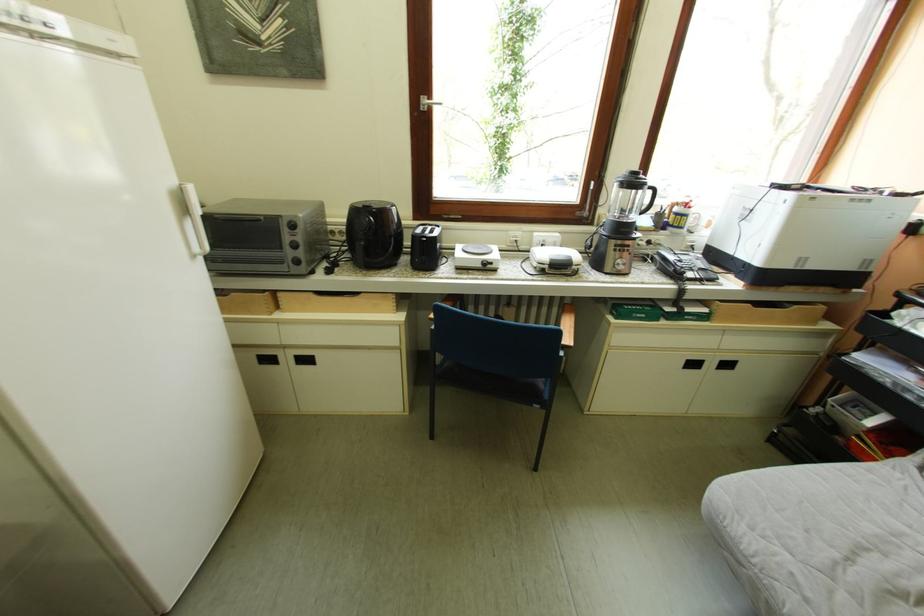
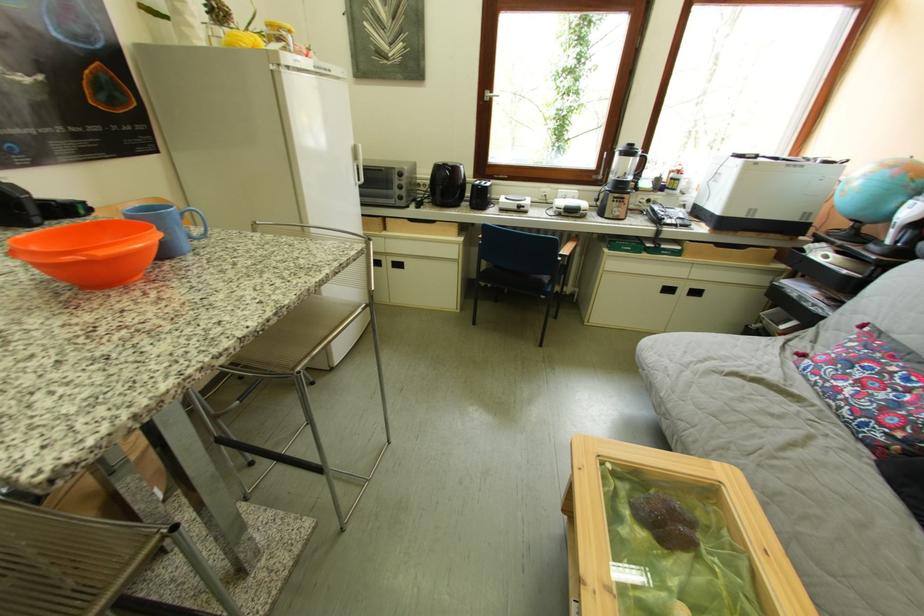
In the second image, find the point that corresponds to (x=370, y=216) in the first image.

(451, 171)